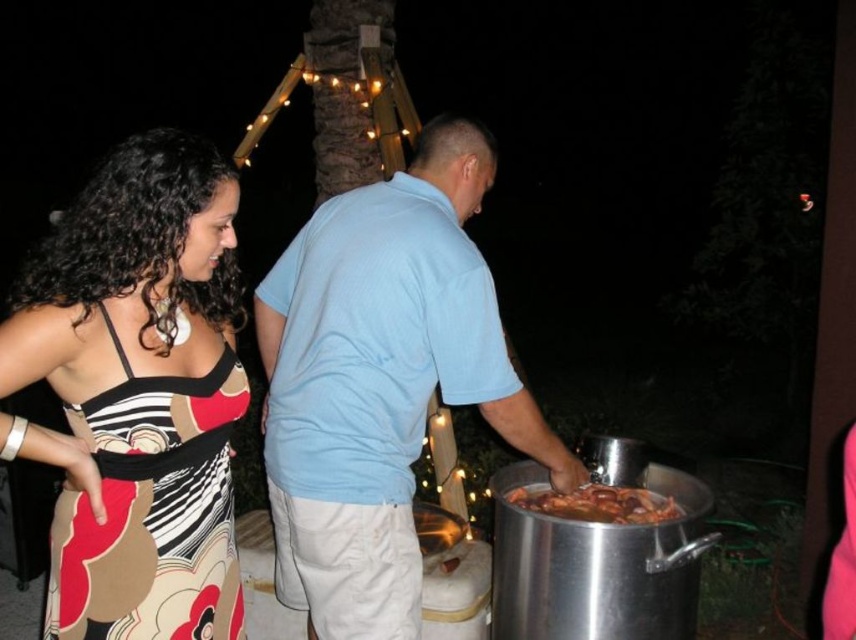
Question: Which is farther from the light blue cotton shirt at center?

Choices:
 (A) printed fabric dress at left
 (B) shiny metallic food at lower right

Answer: (B)

Question: Observing the image, what is the correct spatial positioning of printed fabric dress at left in reference to light blue cotton shirt at center?

Choices:
 (A) below
 (B) above

Answer: (B)

Question: From the image, what is the correct spatial relationship of light blue cotton shirt at center in relation to shiny metallic food at lower right?

Choices:
 (A) below
 (B) above

Answer: (B)

Question: Which object appears farthest from the camera in this image?

Choices:
 (A) printed fabric dress at left
 (B) shiny metallic food at lower right
 (C) light blue cotton shirt at center

Answer: (B)

Question: Among these objects, which one is nearest to the camera?

Choices:
 (A) printed fabric dress at left
 (B) light blue cotton shirt at center
 (C) shiny metallic food at lower right

Answer: (A)

Question: Is printed fabric dress at left bigger than shiny metallic food at lower right?

Choices:
 (A) no
 (B) yes

Answer: (B)